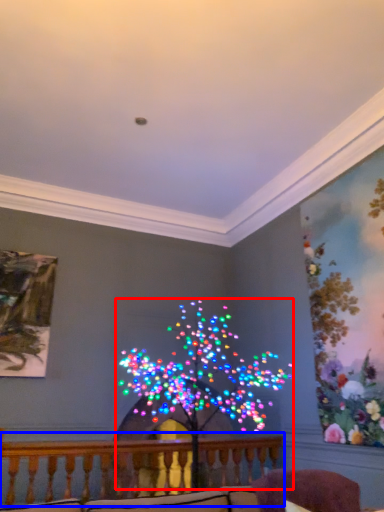
Question: Among these objects, which one is farthest to the camera, christmas decoration (highlighted by a red box) or balcony (highlighted by a blue box)?

Choices:
 (A) christmas decoration
 (B) balcony

Answer: (B)